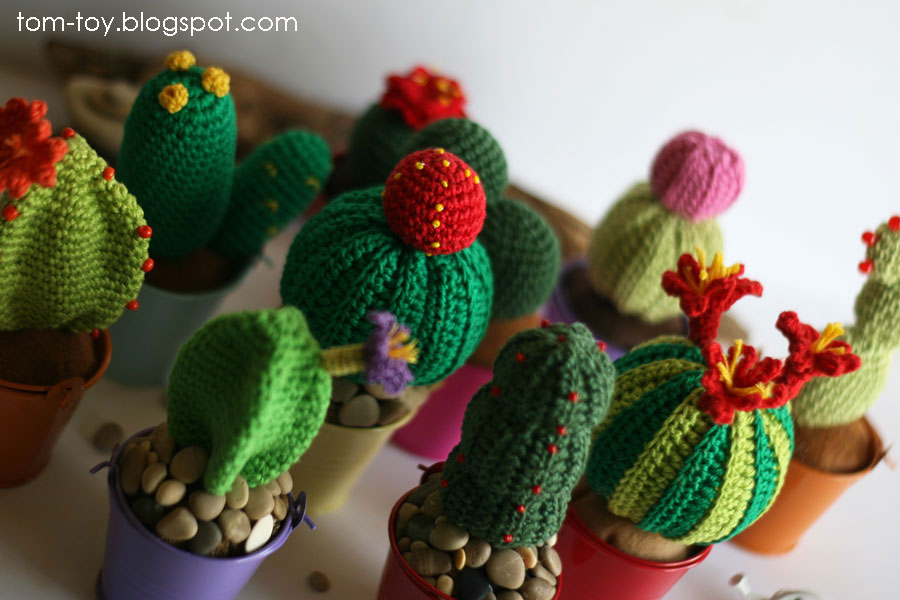
The height and width of the screenshot is (600, 900). I want to click on yellow pot, so click(x=344, y=451).